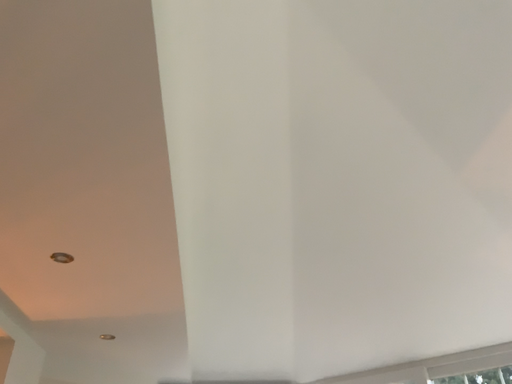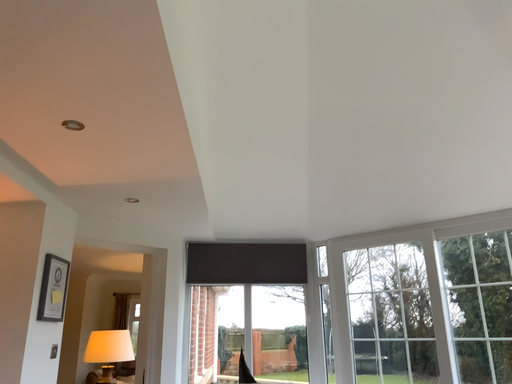
Question: How did the camera likely rotate when shooting the video?

Choices:
 (A) rotated downward
 (B) rotated upward

Answer: (A)